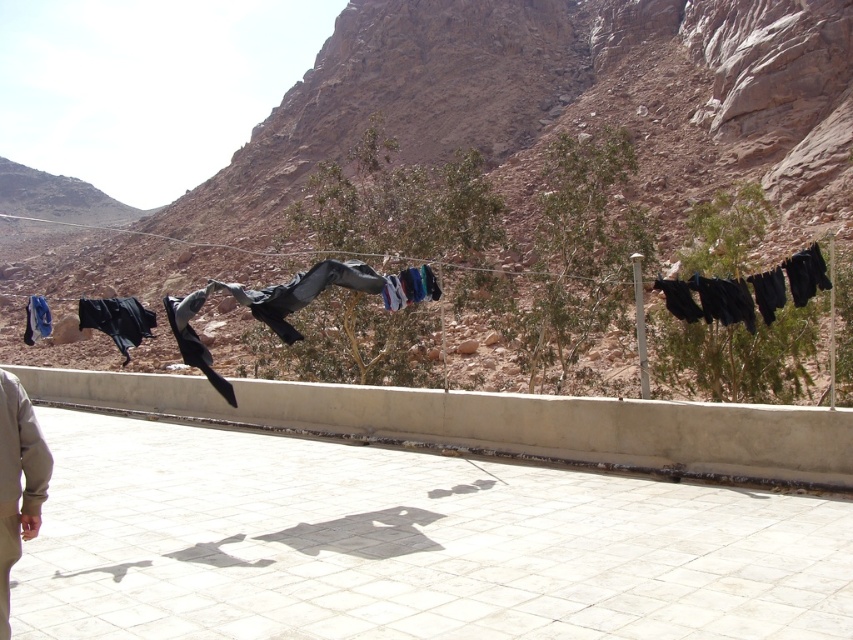
Question: Estimate the real-world distances between objects in this image. Which object is farther from the dull brown rock at upper center?

Choices:
 (A) black matte cloth at left
 (B) black matte pants at center

Answer: (A)

Question: Estimate the real-world distances between objects in this image. Which object is farther from the dull brown rock at upper center?

Choices:
 (A) black matte cloth at left
 (B) black matte pants at center

Answer: (A)

Question: Does black fabric pants at right have a greater width compared to blue fabric at left?

Choices:
 (A) yes
 (B) no

Answer: (B)

Question: Observing the image, what is the correct spatial positioning of black matte pants at center in reference to blue fabric at left?

Choices:
 (A) right
 (B) left

Answer: (A)

Question: Which of the following is the farthest from the observer?

Choices:
 (A) black matte pants at center
 (B) dull brown rock at upper center
 (C) black matte cloth at left

Answer: (B)

Question: Does dull brown rock at upper center appear on the right side of blue fabric at left?

Choices:
 (A) yes
 (B) no

Answer: (A)